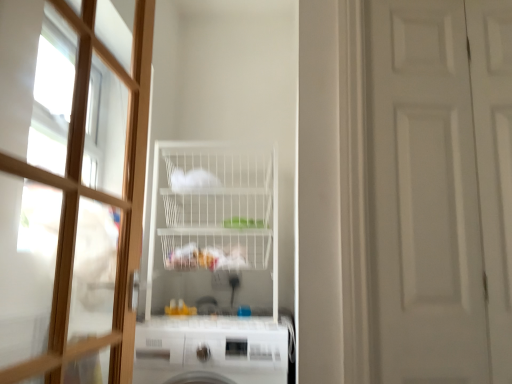
At what (x,y) coordinates should I click in order to perform the action: click on white glossy dishwasher at lower center. Please return your answer as a coordinate pair (x, y). The image size is (512, 384). Looking at the image, I should click on (211, 349).

Measure the distance between point (x=215, y=353) and camera.

4.96 feet.

The height and width of the screenshot is (384, 512). What do you see at coordinates (215, 209) in the screenshot?
I see `white wire shelf at center` at bounding box center [215, 209].

I want to click on white wire shelf at center, so click(x=215, y=209).

You are a GUI agent. You are given a task and a screenshot of the screen. Output one action in this format:
    pyautogui.click(x=<x>, y=<y>)
    Task: Click on the white glossy dishwasher at lower center
    
    Given the screenshot: What is the action you would take?
    pyautogui.click(x=211, y=349)

Consider the image. Is white glossy dishwasher at lower center positioned with its back to white wire shelf at center?

white glossy dishwasher at lower center does not have its back to white wire shelf at center.

Who is smaller, white glossy dishwasher at lower center or white wire shelf at center?

Smaller between the two is white glossy dishwasher at lower center.

Is white glossy dishwasher at lower center not close to white wire shelf at center?

No, white glossy dishwasher at lower center is in close proximity to white wire shelf at center.

Consider the image. Can you confirm if wooden door at left, which appears as the 2th door when viewed from the right, is shorter than white matte door at right, placed as the second door when sorted from left to right?

Yes, wooden door at left, which appears as the 2th door when viewed from the right, is shorter than white matte door at right, placed as the second door when sorted from left to right.

What's the angular difference between wooden door at left, which appears as the 2th door when viewed from the right, and white matte door at right, placed as the second door when sorted from left to right,'s facing directions?

89 degrees separate the facing orientations of wooden door at left, which appears as the 2th door when viewed from the right, and white matte door at right, placed as the second door when sorted from left to right.

The width and height of the screenshot is (512, 384). In order to click on door located below the wooden door at left, which appears as the 2th door when viewed from the right (from the image's perspective) in this screenshot , I will do `click(441, 189)`.

Based on their positions, is wooden door at left, which appears as the 2th door when viewed from the right, located to the left or right of white matte door at right, which is counted as the 1th door, starting from the right?

Based on their positions, wooden door at left, which appears as the 2th door when viewed from the right, is located to the left of white matte door at right, which is counted as the 1th door, starting from the right.

How different are the orientations of white wire shelf at center and white glossy dishwasher at lower center in degrees?

0.125 degrees.

Considering their positions, is white wire shelf at center located in front of or behind white glossy dishwasher at lower center?

Visually, white wire shelf at center is located behind white glossy dishwasher at lower center.

Are white wire shelf at center and white glossy dishwasher at lower center far apart?

They are positioned close to each other.

Considering the sizes of objects white wire shelf at center and white glossy dishwasher at lower center in the image provided, who is taller, white wire shelf at center or white glossy dishwasher at lower center?

Standing taller between the two is white wire shelf at center.

Is white wire shelf at center at the left side of white matte door at right, placed as the second door when sorted from left to right?

Correct, you'll find white wire shelf at center to the left of white matte door at right, placed as the second door when sorted from left to right.

This screenshot has width=512, height=384. In order to click on door on the right of white wire shelf at center in this screenshot , I will do coord(441,189).

Which object is more forward, white wire shelf at center or white matte door at right, which is counted as the 1th door, starting from the right?

white matte door at right, which is counted as the 1th door, starting from the right, is in front.

From the image's perspective, relative to white matte door at right, placed as the second door when sorted from left to right, is white wire shelf at center above or below?

From the image's perspective, white wire shelf at center appears below white matte door at right, placed as the second door when sorted from left to right.

Does white wire shelf at center lie behind wooden door at left, which appears as the 2th door when viewed from the right?

Yes, the depth of white wire shelf at center is greater than that of wooden door at left, which appears as the 2th door when viewed from the right.

Looking at this image, from the image's perspective, is white wire shelf at center on wooden door at left, the first door from the left?

Incorrect, from the image's perspective, white wire shelf at center is lower than wooden door at left, the first door from the left.

Is white wire shelf at center facing away from wooden door at left, the first door from the left?

No.

Between white wire shelf at center and wooden door at left, the first door from the left, which one has more height?

wooden door at left, the first door from the left.

Between white matte door at right, which is counted as the 1th door, starting from the right, and white wire shelf at center, which one has larger width?

Wider between the two is white wire shelf at center.

Which is further, (435, 342) or (262, 156)?

The point (262, 156) is behind.

Considering the positions of objects white matte door at right, placed as the second door when sorted from left to right, and white wire shelf at center in the image provided, who is behind, white matte door at right, placed as the second door when sorted from left to right, or white wire shelf at center?

Positioned behind is white wire shelf at center.

Can you confirm if white matte door at right, placed as the second door when sorted from left to right, is bigger than white wire shelf at center?

Actually, white matte door at right, placed as the second door when sorted from left to right, might be smaller than white wire shelf at center.

In the scene shown: From a real-world perspective, relative to wooden door at left, which appears as the 2th door when viewed from the right, is white matte door at right, placed as the second door when sorted from left to right, vertically above or below?

white matte door at right, placed as the second door when sorted from left to right, is above wooden door at left, which appears as the 2th door when viewed from the right.

From the image's perspective, would you say white matte door at right, which is counted as the 1th door, starting from the right, is shown under wooden door at left, the first door from the left?

Correct, white matte door at right, which is counted as the 1th door, starting from the right, appears lower than wooden door at left, the first door from the left, in the image.

This screenshot has width=512, height=384. In the image, there is a white wire shelf at center. Find the location of `dish washer below it (from a real-world perspective)`. dish washer below it (from a real-world perspective) is located at coordinates (211, 349).

This screenshot has height=384, width=512. I want to click on door on the right side of wooden door at left, which appears as the 2th door when viewed from the right, so click(x=441, y=189).

Looking at this image, considering their positions, is white matte door at right, which is counted as the 1th door, starting from the right, positioned closer to wooden door at left, the first door from the left, than white wire shelf at center?

white wire shelf at center.

From the image, which object appears to be nearer to white wire shelf at center, white glossy dishwasher at lower center or wooden door at left, the first door from the left?

white glossy dishwasher at lower center.

In the scene shown: From the image, which object appears to be nearer to white matte door at right, which is counted as the 1th door, starting from the right, white wire shelf at center or wooden door at left, the first door from the left?

Among the two, wooden door at left, the first door from the left, is located nearer to white matte door at right, which is counted as the 1th door, starting from the right.

Based on their spatial positions, is white matte door at right, placed as the second door when sorted from left to right, or wooden door at left, the first door from the left, closer to white glossy dishwasher at lower center?

wooden door at left, the first door from the left.

Estimate the real-world distances between objects in this image. Which object is further from wooden door at left, the first door from the left, white glossy dishwasher at lower center or white wire shelf at center?

white wire shelf at center.

From the image, which object appears to be nearer to white wire shelf at center, white matte door at right, placed as the second door when sorted from left to right, or white glossy dishwasher at lower center?

white glossy dishwasher at lower center lies closer to white wire shelf at center than the other object.

Considering their positions, is white glossy dishwasher at lower center positioned closer to white wire shelf at center than white matte door at right, which is counted as the 1th door, starting from the right?

white glossy dishwasher at lower center lies closer to white wire shelf at center than the other object.

When comparing their distances from white wire shelf at center, does white matte door at right, placed as the second door when sorted from left to right, or wooden door at left, the first door from the left, seem closer?

wooden door at left, the first door from the left, is closer to white wire shelf at center.

The width and height of the screenshot is (512, 384). I want to click on dish washer positioned between wooden door at left, which appears as the 2th door when viewed from the right, and white wire shelf at center from near to far, so click(x=211, y=349).

Find the location of a particular element. Image resolution: width=512 pixels, height=384 pixels. door located between wooden door at left, the first door from the left, and white wire shelf at center in the depth direction is located at coordinates (441, 189).

Locate an element on the screen. shelf situated between white glossy dishwasher at lower center and white matte door at right, placed as the second door when sorted from left to right, from left to right is located at coordinates (215, 209).

Image resolution: width=512 pixels, height=384 pixels. I want to click on dish washer situated between wooden door at left, the first door from the left, and white matte door at right, placed as the second door when sorted from left to right, from left to right, so click(x=211, y=349).